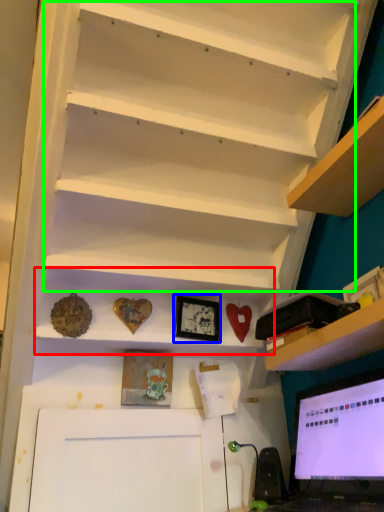
Question: Which object is the closest to the cabinet (highlighted by a red box)? Choose among these: picture frame (highlighted by a blue box) or stair (highlighted by a green box).

Choices:
 (A) picture frame
 (B) stair

Answer: (A)